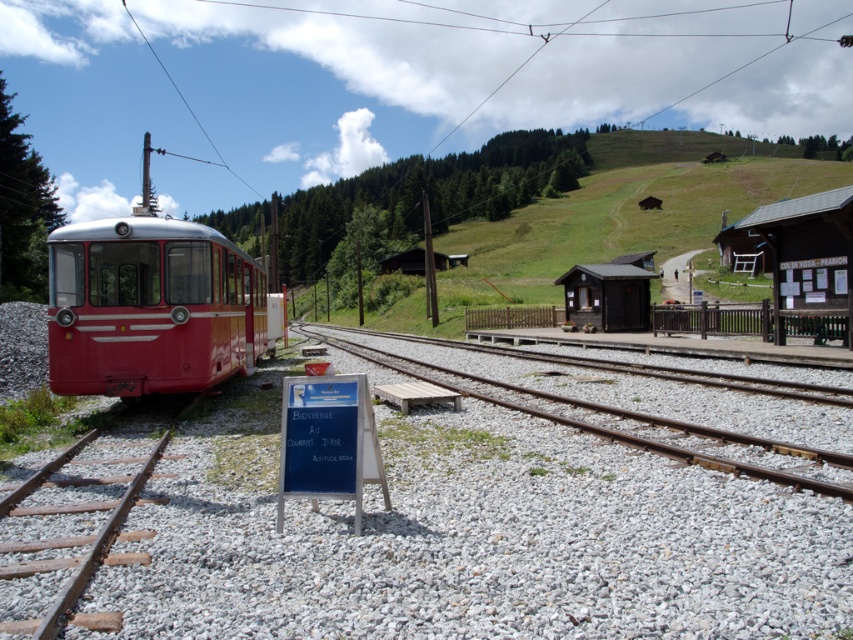
Question: Which point is farther to the camera?

Choices:
 (A) (764, 234)
 (B) (129, 310)
 (C) (746, 449)

Answer: (A)

Question: Does gray gravel at center appear over brown wooden train track at lower left?

Choices:
 (A) no
 (B) yes

Answer: (B)

Question: Is gray gravel at center wider than brown wooden train track at lower left?

Choices:
 (A) yes
 (B) no

Answer: (A)

Question: Does brown wooden signboard at right have a smaller size compared to smooth gravel track at center?

Choices:
 (A) no
 (B) yes

Answer: (A)

Question: Which point is closer to the camera?

Choices:
 (A) red polished metal train at left
 (B) brown wooden signboard at right
 (C) smooth gravel track at center

Answer: (C)

Question: Which object is the closest to the red polished metal train at left?

Choices:
 (A) brown wooden train track at lower left
 (B) gray gravel at center

Answer: (B)